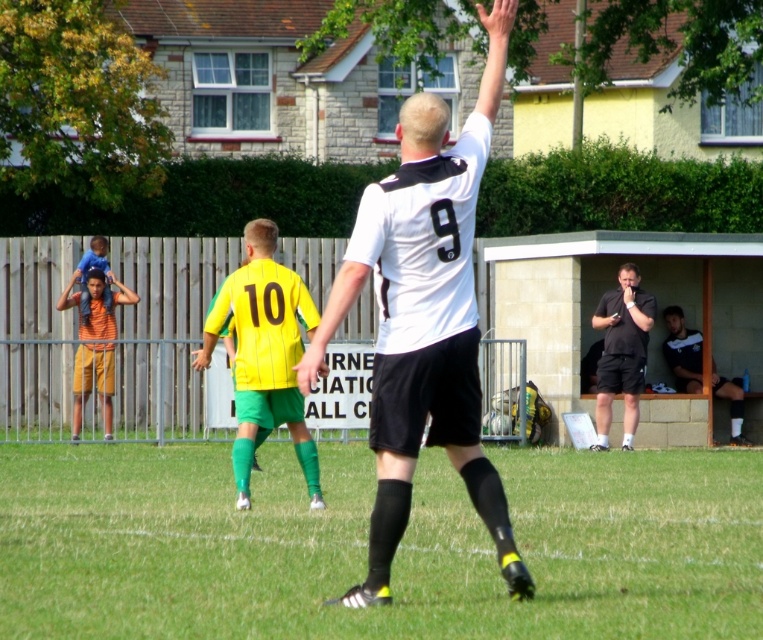
Can you confirm if green grass at center is positioned to the right of orange cotton shorts at left?

Indeed, green grass at center is positioned on the right side of orange cotton shorts at left.

Looking at this image, is green grass at center taller than orange cotton shorts at left?

In fact, green grass at center may be shorter than orange cotton shorts at left.

This screenshot has width=763, height=640. In order to click on green grass at center in this screenshot , I will do `click(365, 545)`.

Between white matte jersey at center and blue fabric boy at left, which one appears on the right side from the viewer's perspective?

Positioned to the right is white matte jersey at center.

Is point (456, 412) farther from camera compared to point (95, 241)?

No.

Locate an element on the screen. The width and height of the screenshot is (763, 640). white matte jersey at center is located at coordinates (423, 317).

Is white matte jersey at center taller than black matte shirt at right?

Yes, white matte jersey at center is taller than black matte shirt at right.

Is point (401, 442) farther from camera compared to point (626, 266)?

No, (401, 442) is closer to viewer.

Is point (406, 364) behind point (617, 346)?

No, (406, 364) is closer to viewer.

Identify the location of white matte jersey at center. (423, 317).